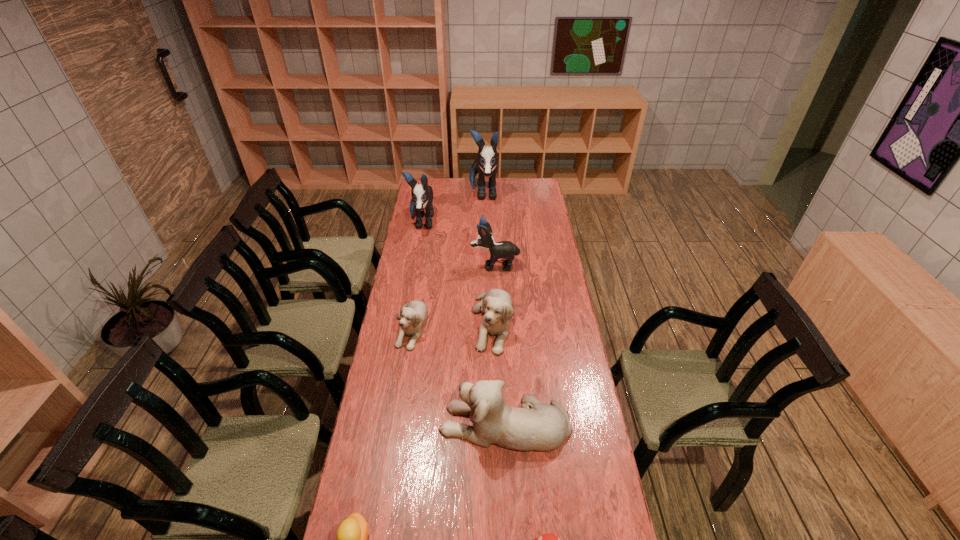
I want to click on the biggest black puppy, so click(x=486, y=164).

I want to click on the tallest object, so click(x=486, y=164).

I want to click on the second biggest black puppy, so click(x=422, y=195).

The height and width of the screenshot is (540, 960). I want to click on the fifth shortest puppy, so click(x=422, y=195).

Where is `the smallest black puppy`? This screenshot has width=960, height=540. the smallest black puppy is located at coordinates (507, 250).

Image resolution: width=960 pixels, height=540 pixels. I want to click on the nearest black puppy, so coord(507,250).

Identify the location of the nearest puppy. The height and width of the screenshot is (540, 960). (543, 427).

The image size is (960, 540). I want to click on the fifth shortest object, so click(543, 427).

Where is `the second smallest white puppy`? This screenshot has width=960, height=540. the second smallest white puppy is located at coordinates (496, 304).

The image size is (960, 540). I want to click on the fifth tallest object, so click(x=496, y=304).